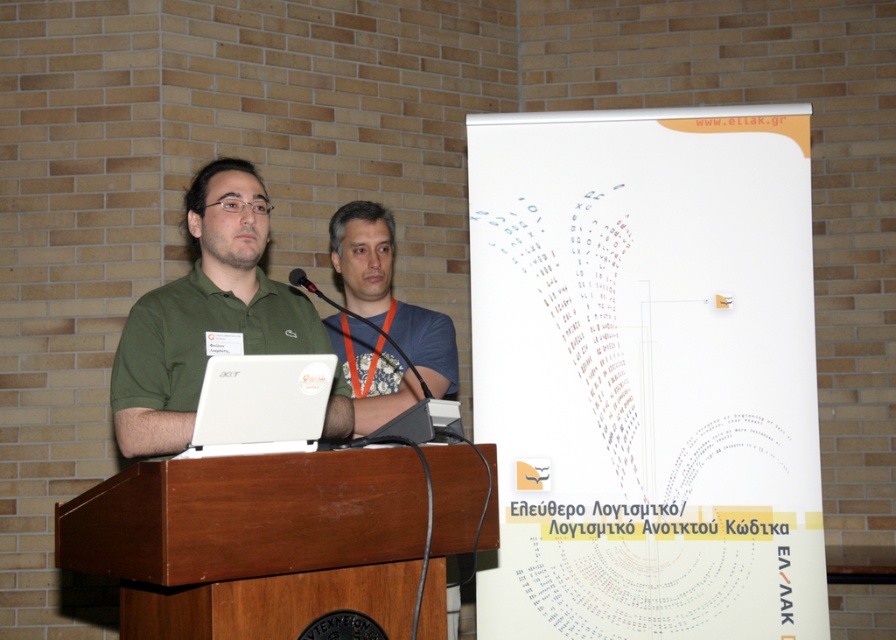
Looking at this image, you are an event organizer who needs to adjust the microphone height for a speaker wearing the green matte shirt at center. Given that the black plastic microphone at center is currently positioned at 1.2 meters from the floor, what should be the minimum height you set the microphone to ensure it reaches the speaker?

The green matte shirt at center is taller than the black plastic microphone at center. Since the microphone is currently at 1.2 meters, you should set the microphone to at least 1.2 meters to ensure it reaches the speaker.

You are an event organizer who needs to set up a camera to capture both the green matte shirt at center and the black plastic microphone at center clearly. Based on their positions, which one should be closer to the camera?

The green matte shirt at center is in front of the black plastic microphone at center, so the green matte shirt at center is closer to the camera.